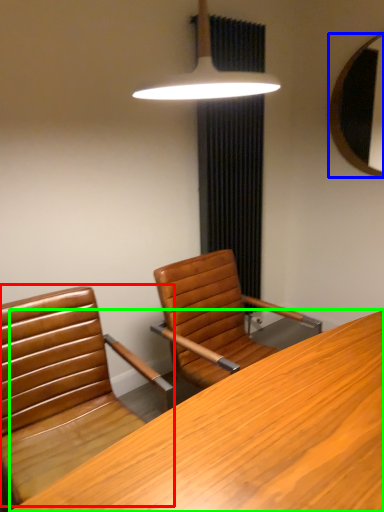
Question: Estimate the real-world distances between objects in this image. Which object is closer to chair (highlighted by a red box), mirror (highlighted by a blue box) or desk (highlighted by a green box)?

Choices:
 (A) mirror
 (B) desk

Answer: (B)